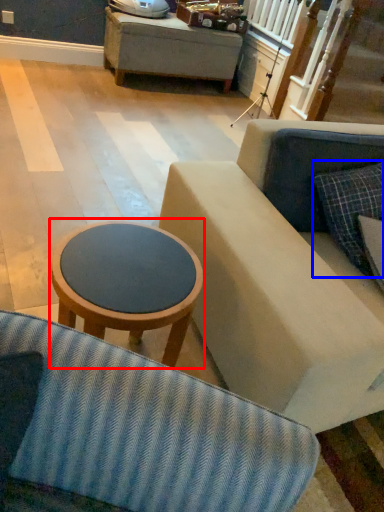
Question: Which of the following is the farthest to the observer, table (highlighted by a red box) or pillow (highlighted by a blue box)?

Choices:
 (A) table
 (B) pillow

Answer: (B)